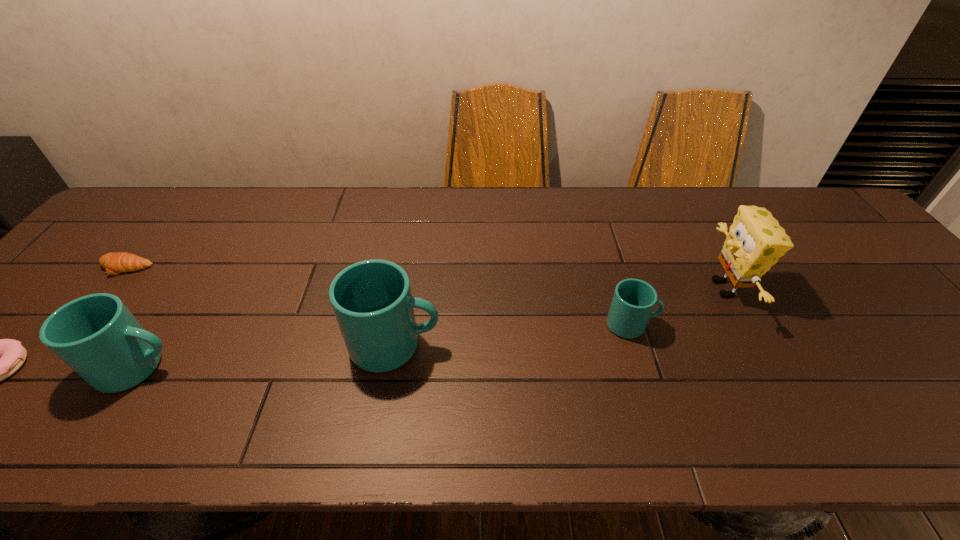
Identify the location of free point located 0.180m on the face of the sponge. (635, 288).

Image resolution: width=960 pixels, height=540 pixels. I want to click on vacant space located on the face of the sponge, so click(549, 288).

This screenshot has height=540, width=960. I want to click on blank area located on the face of the sponge, so click(x=638, y=288).

Find the location of a particular element. This screenshot has width=960, height=540. vacant point located 0.220m on the back of the crescent roll is located at coordinates (172, 211).

This screenshot has height=540, width=960. I want to click on object that is at the left edge, so click(x=114, y=263).

This screenshot has height=540, width=960. In order to click on vacant space at the far edge of the desktop in this screenshot , I will do `click(643, 212)`.

At what (x,y) coordinates should I click in order to perform the action: click on vacant space at the near edge of the desktop. Please return your answer as a coordinate pair (x, y). Looking at the image, I should click on 536,376.

Where is `vacant space at the left edge of the desktop`? The width and height of the screenshot is (960, 540). vacant space at the left edge of the desktop is located at coordinates (98, 256).

Where is `vacant area at the right edge of the desktop`? vacant area at the right edge of the desktop is located at coordinates (839, 257).

In the image, there is a desktop. Find the location of `vacant space at the far left corner`. vacant space at the far left corner is located at coordinates (143, 215).